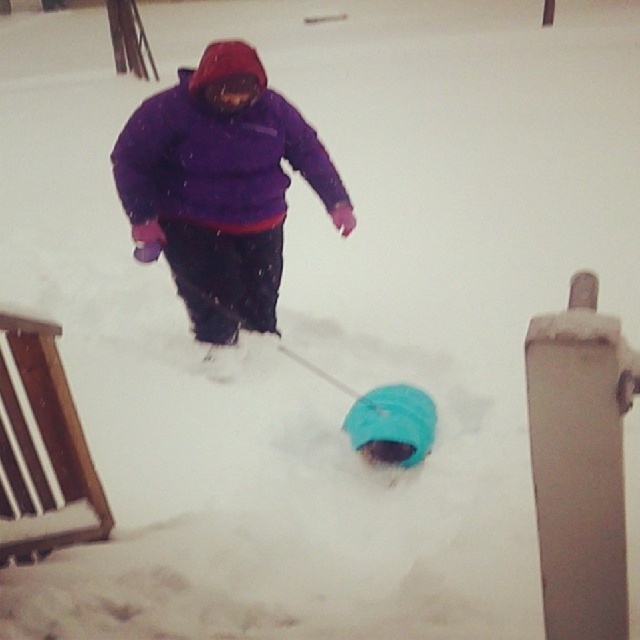
Is purple fleece jacket at center above matte blue snow tube at center?

Yes, purple fleece jacket at center is above matte blue snow tube at center.

Between point (184, 81) and point (388, 400), which one is positioned in front?

Positioned in front is point (388, 400).

Is point (129, 132) closer to camera compared to point (410, 440)?

No, (129, 132) is behind (410, 440).

The height and width of the screenshot is (640, 640). What are the coordinates of `purple fleece jacket at center` in the screenshot? It's located at (220, 186).